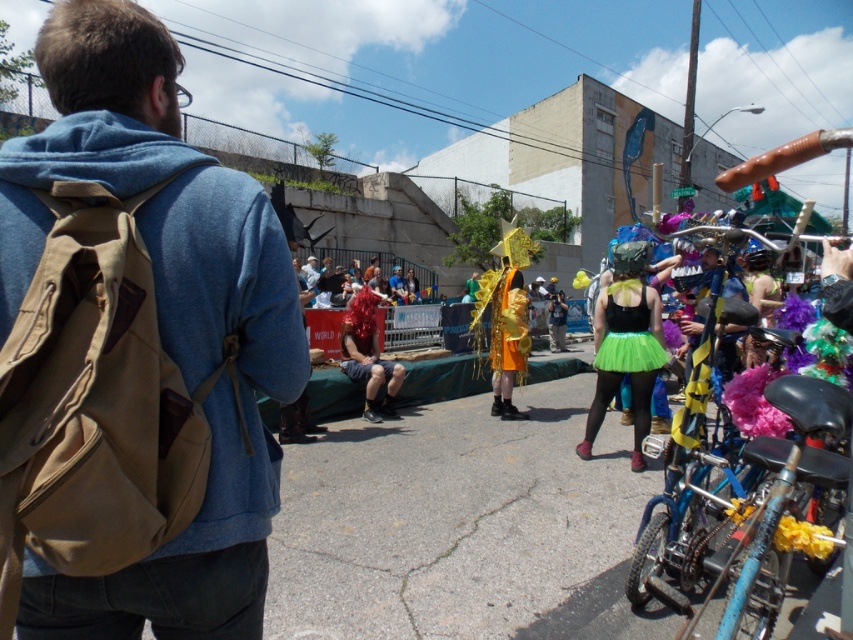
Does blue metallic bicycle at right have a greater height compared to gold shiny costume at center?

Yes.

Does blue metallic bicycle at right have a smaller size compared to gold shiny costume at center?

Actually, blue metallic bicycle at right might be larger than gold shiny costume at center.

Who is more distant from viewer, (772,305) or (509,300)?

Point (509,300)

This screenshot has height=640, width=853. I want to click on blue metallic bicycle at right, so click(784, 157).

You are a GUI agent. You are given a task and a screenshot of the screen. Output one action in this format:
    pyautogui.click(x=<x>, y=<y>)
    Task: Click on the blue metallic bicycle at lower right
    Image resolution: width=853 pixels, height=640 pixels.
    Given the screenshot: What is the action you would take?
    pyautogui.click(x=809, y=404)

Between shiny red wig at center and green tulle skirt at center, which one is positioned lower?

green tulle skirt at center is below.

Describe the element at coordinates (368, 355) in the screenshot. I see `shiny red wig at center` at that location.

Image resolution: width=853 pixels, height=640 pixels. Find the location of `shiny red wig at center`. shiny red wig at center is located at coordinates (368, 355).